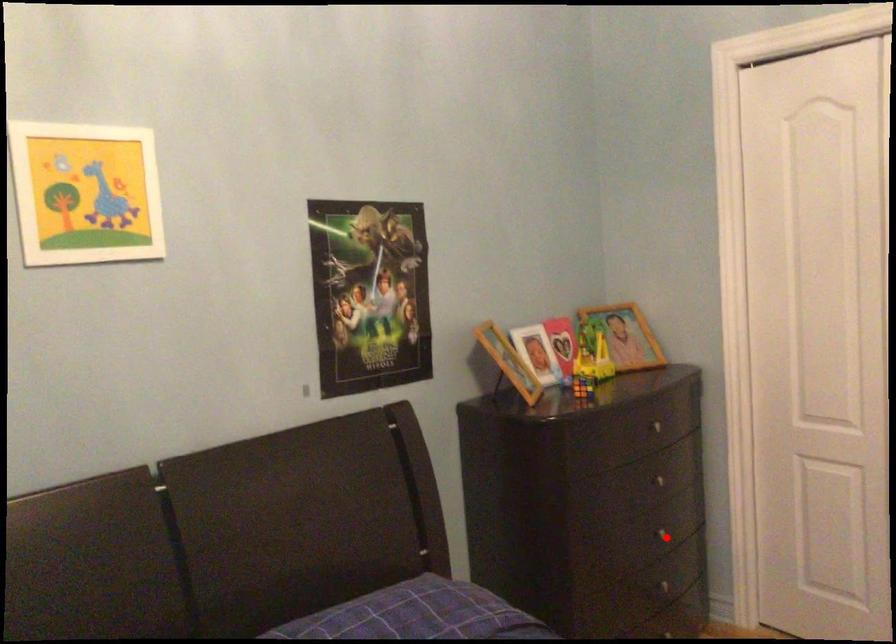
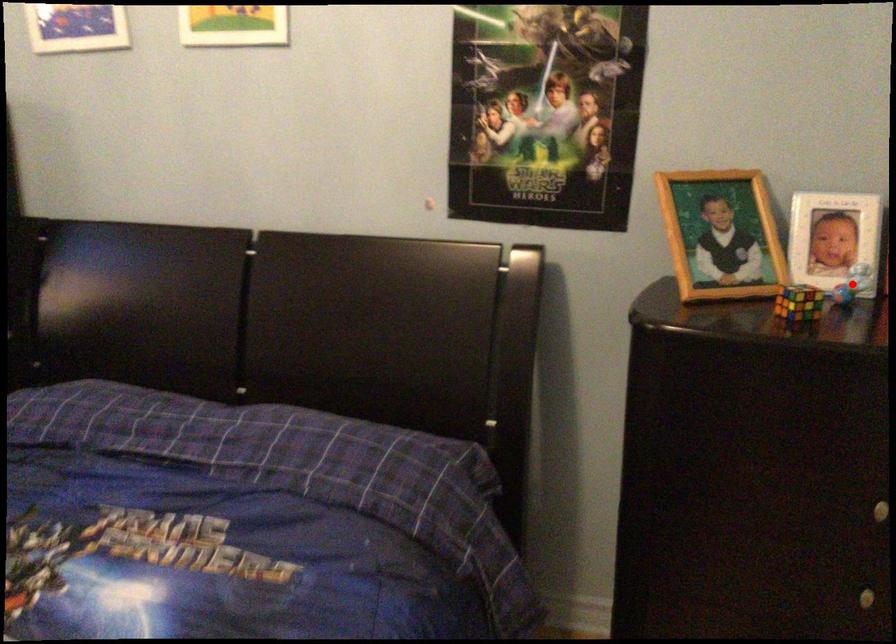
I am providing you with two images of the same scene from different viewpoints. A red point is marked on the first image and another point is marked on the second image. Are the points marked in image1 and image2 representing the same 3D position?

No